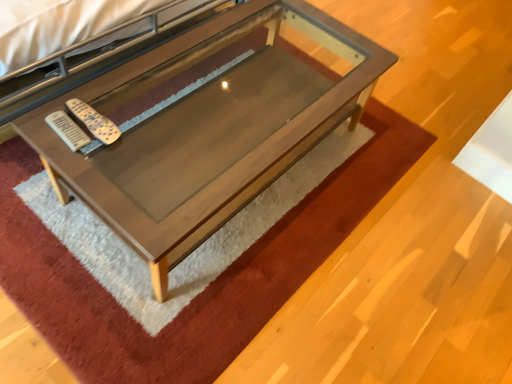
You are a GUI agent. You are given a task and a screenshot of the screen. Output one action in this format:
    pyautogui.click(x=<x>, y=<y>)
    Task: Click on the free space in front of white plastic remote at center-left, placed as the 1th remote when sorted from right to left
    
    Given the screenshot: What is the action you would take?
    pyautogui.click(x=76, y=158)